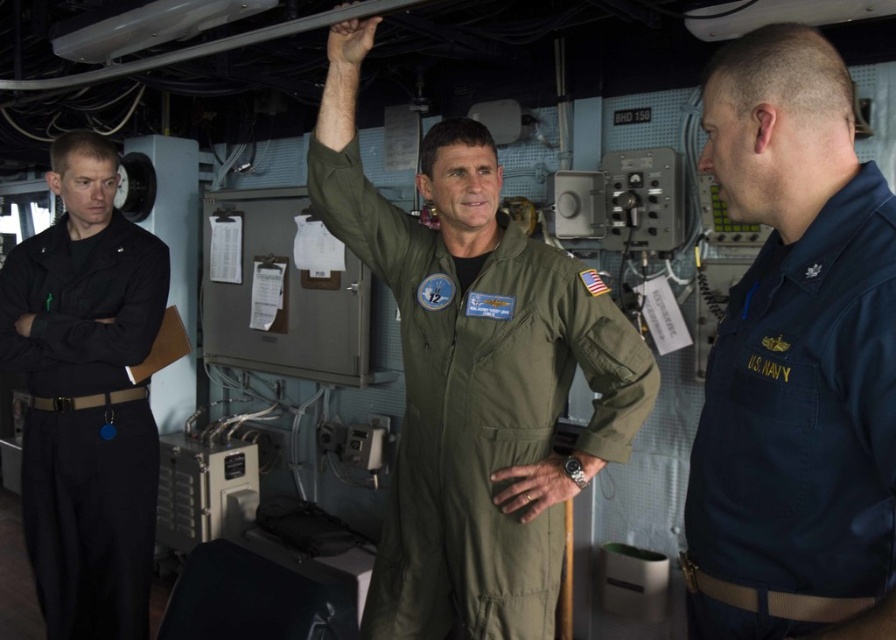
Describe the element at coordinates (799, 432) in the screenshot. I see `navy blue fabric us navy uniform at right` at that location.

Who is shorter, navy blue fabric us navy uniform at right or black cotton pants at left?

Standing shorter between the two is navy blue fabric us navy uniform at right.

Between point (828, 387) and point (145, 298), which one is positioned behind?

Positioned behind is point (145, 298).

Find the location of a particular element. Image resolution: width=896 pixels, height=640 pixels. navy blue fabric us navy uniform at right is located at coordinates (799, 432).

Is olive green fabric jumpsuit at center shorter than navy blue fabric us navy uniform at right?

Incorrect, olive green fabric jumpsuit at center's height does not fall short of navy blue fabric us navy uniform at right's.

Is olive green fabric jumpsuit at center closer to the viewer compared to navy blue fabric us navy uniform at right?

No, olive green fabric jumpsuit at center is behind navy blue fabric us navy uniform at right.

What do you see at coordinates (479, 412) in the screenshot?
I see `olive green fabric jumpsuit at center` at bounding box center [479, 412].

Identify the location of olive green fabric jumpsuit at center. (479, 412).

Who is shorter, olive green fabric jumpsuit at center or black cotton pants at left?

Standing shorter between the two is olive green fabric jumpsuit at center.

Is point (383, 576) positioned before point (2, 272)?

Yes, point (383, 576) is closer to viewer.

Is point (475, 461) farther from camera compared to point (145, 579)?

No, it is not.

At what (x,y) coordinates should I click in order to perform the action: click on olive green fabric jumpsuit at center. Please return your answer as a coordinate pair (x, y). Image resolution: width=896 pixels, height=640 pixels. Looking at the image, I should click on (479, 412).